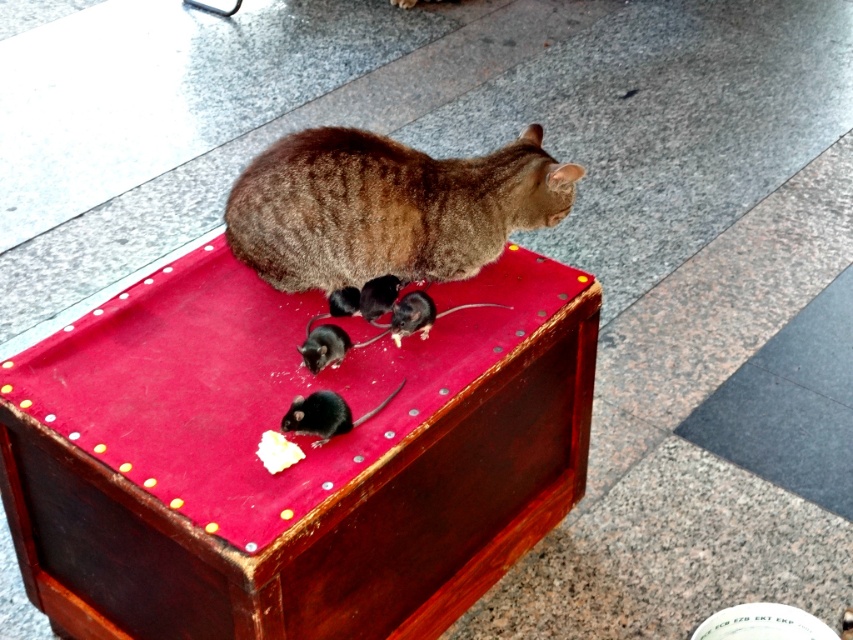
You are a mouse trying to escape the cat. You see the brown fur cat at center and the shiny black mouse at center. Which one is wider?

The brown fur cat at center is wider than the shiny black mouse at center.

You are a mouse in the scene. You see the brown fur cat at center and the shiny black mouse at center. Which one is bigger?

The brown fur cat at center is larger in size than the shiny black mouse at center.

You are a cat watching the shiny black mouse at center and the black matte mouse at center. Which mouse is taller?

The shiny black mouse at center is taller than the black matte mouse at center.